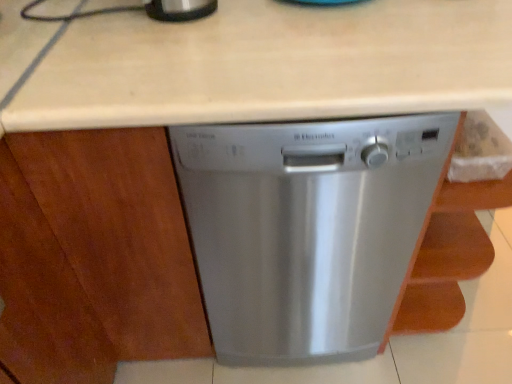
This screenshot has width=512, height=384. What do you see at coordinates (307, 230) in the screenshot?
I see `satin silver dishwasher at center` at bounding box center [307, 230].

You are a GUI agent. You are given a task and a screenshot of the screen. Output one action in this format:
    pyautogui.click(x=<x>, y=<y>)
    Task: Click on the satin silver dishwasher at center
    The image size is (512, 384).
    Given the screenshot: What is the action you would take?
    pyautogui.click(x=307, y=230)

You are a GUI agent. You are given a task and a screenshot of the screen. Output one action in this format:
    pyautogui.click(x=<x>, y=<y>)
    Task: Click on the satin silver dishwasher at center
    This screenshot has height=384, width=512.
    Given the screenshot: What is the action you would take?
    pyautogui.click(x=307, y=230)